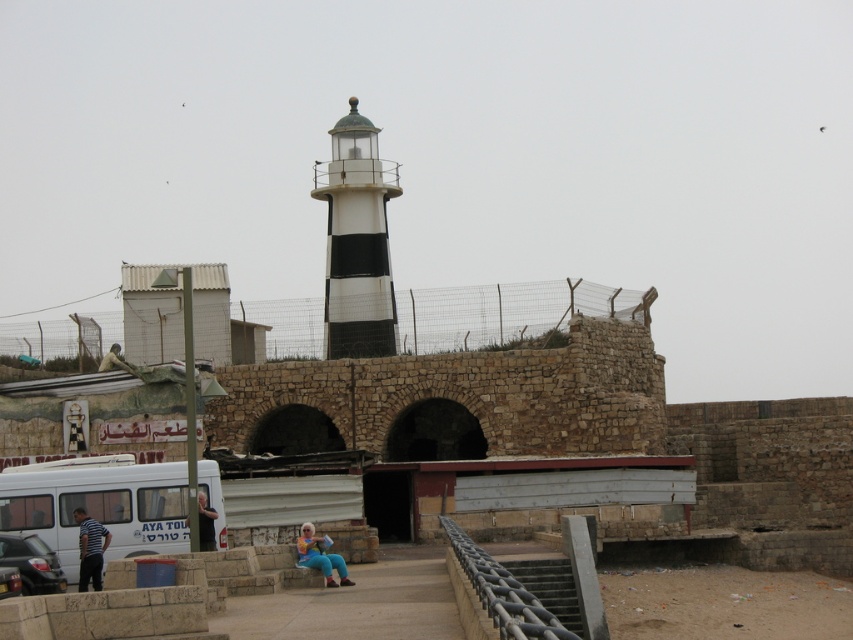
Question: Can you confirm if white matte van at lower left is smaller than striped cotton shirt at lower left?

Choices:
 (A) yes
 (B) no

Answer: (B)

Question: Based on their relative distances, which object is nearer to the blue jeans at lower center?

Choices:
 (A) metallic gray stairs at lower center
 (B) white matte van at lower left
 (C) metallic chain-link rail at center

Answer: (B)

Question: Among these points, which one is nearest to the camera?

Choices:
 (A) (329, 572)
 (B) (79, 577)
 (C) (480, 596)
 (D) (544, 596)

Answer: (C)

Question: Which point is closer to the camera taking this photo?

Choices:
 (A) (341, 580)
 (B) (525, 561)

Answer: (A)

Question: Is striped cotton shirt at lower left smaller than pastel blue jeans at center?

Choices:
 (A) no
 (B) yes

Answer: (B)

Question: Is striped cotton shirt at lower left smaller than pastel blue jeans at center?

Choices:
 (A) yes
 (B) no

Answer: (A)